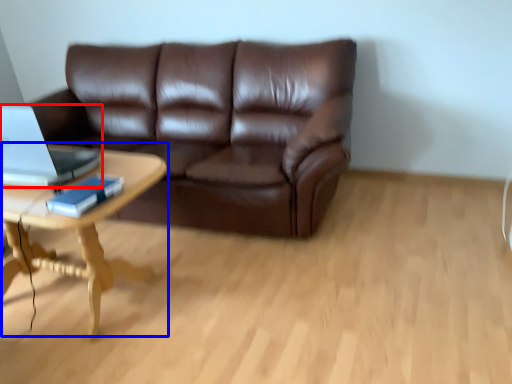
Question: Which point is closer to the camera, laptop (highlighted by a red box) or coffee table (highlighted by a blue box)?

Choices:
 (A) laptop
 (B) coffee table

Answer: (B)